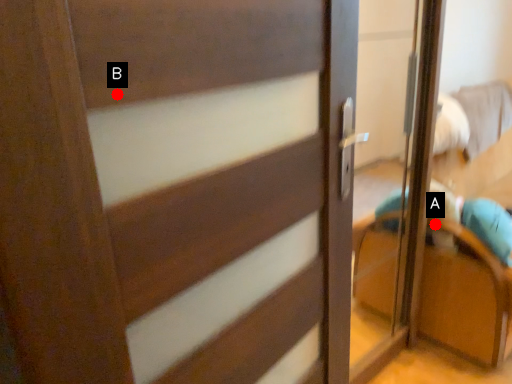
Question: Two points are circled on the image, labeled by A and B beside each circle. Which point appears farthest from the camera in this image?

Choices:
 (A) A is further
 (B) B is further

Answer: (A)